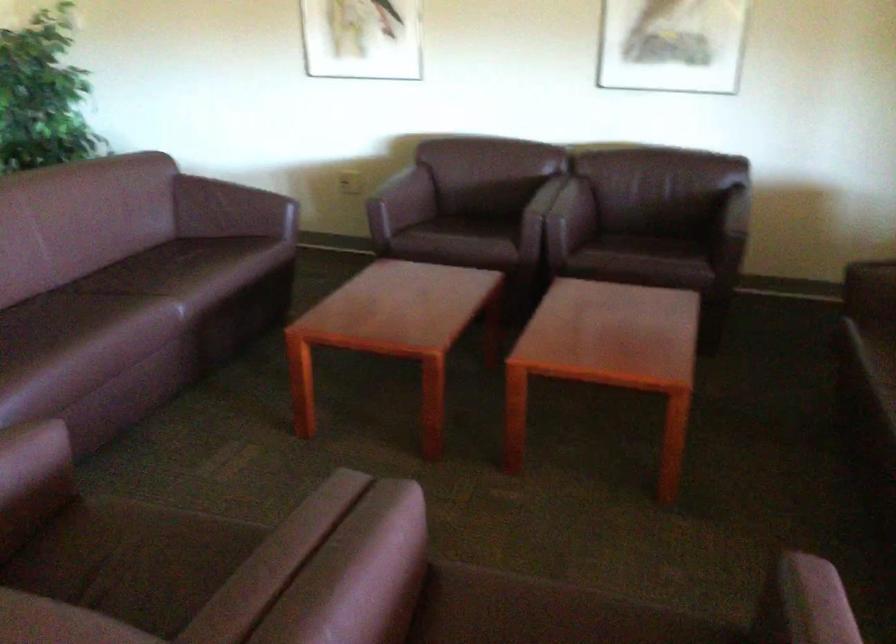
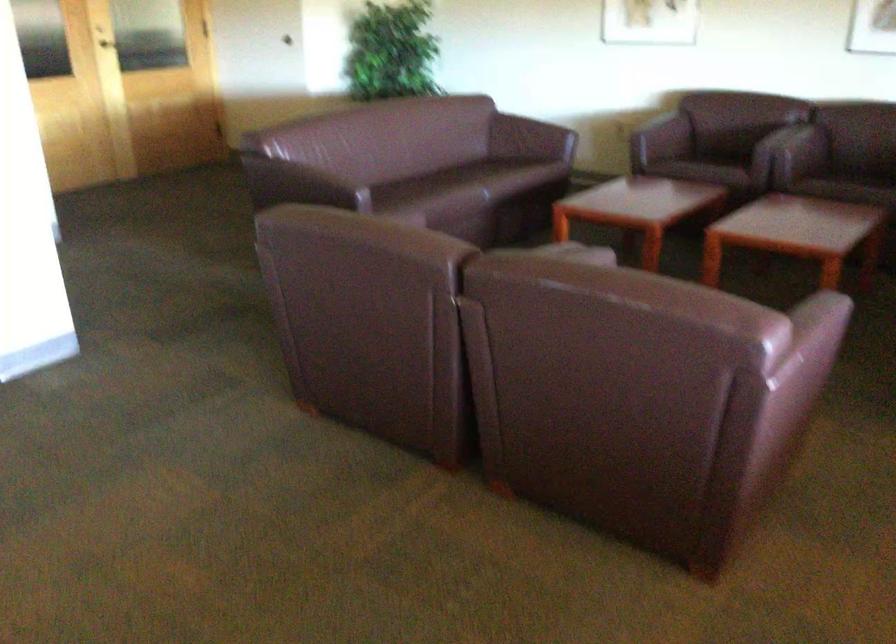
The point at [647,274] is marked in the first image. Where is the corresponding point in the second image?

(853, 185)